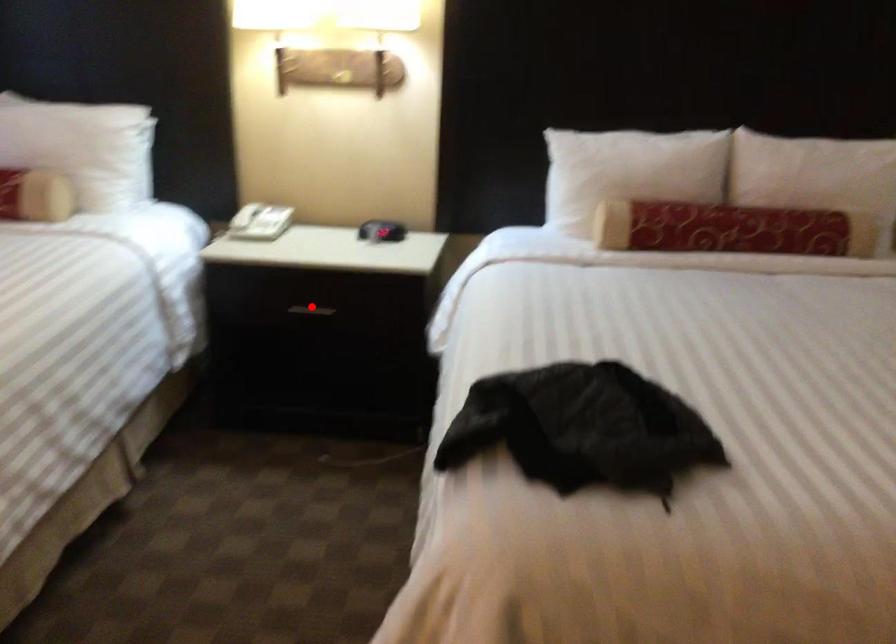
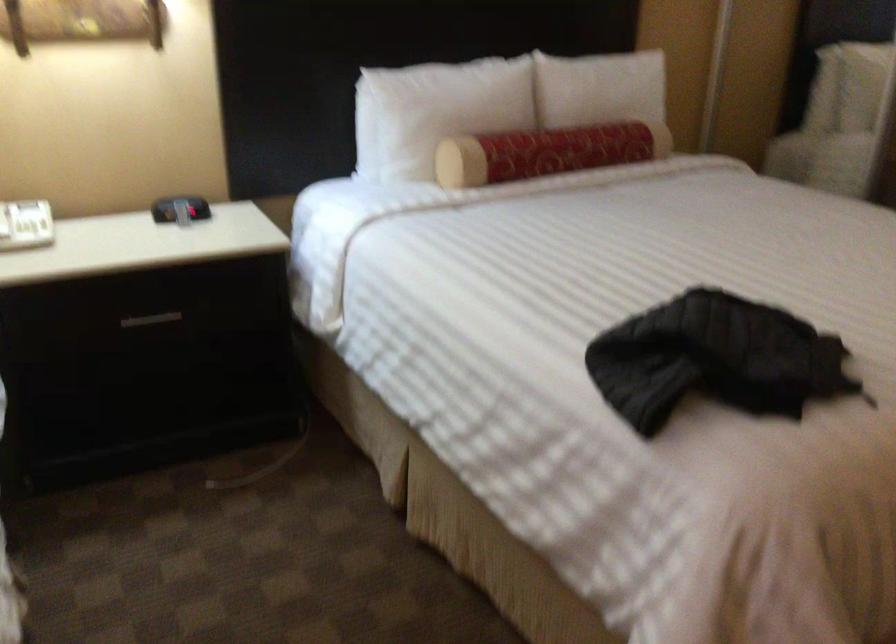
Question: I am providing you with two images of the same scene from different viewpoints. In image1, a red point is highlighted. Considering the same 3D point in image2, which of the following is correct?

Choices:
 (A) It is closer
 (B) It is farther

Answer: (A)